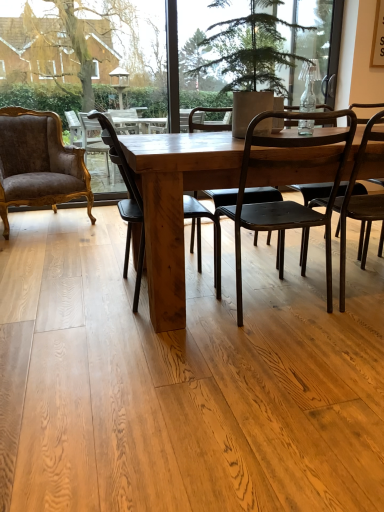
At what (x,y) coordinates should I click in order to perform the action: click on vacant region to the left of matte black chair at center, acting as the 3th chair starting from the left. Please return your answer as a coordinate pair (x, y). Looking at the image, I should click on (182, 327).